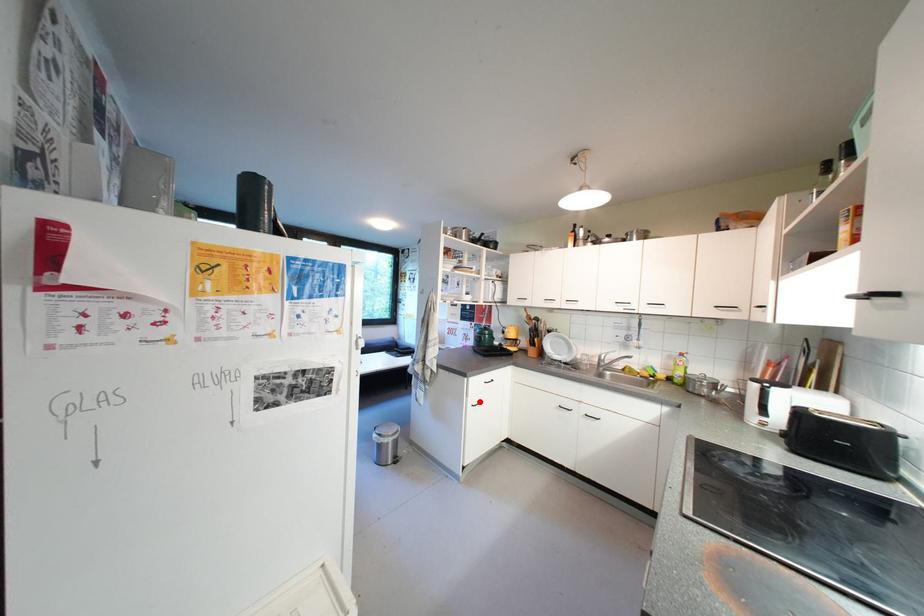
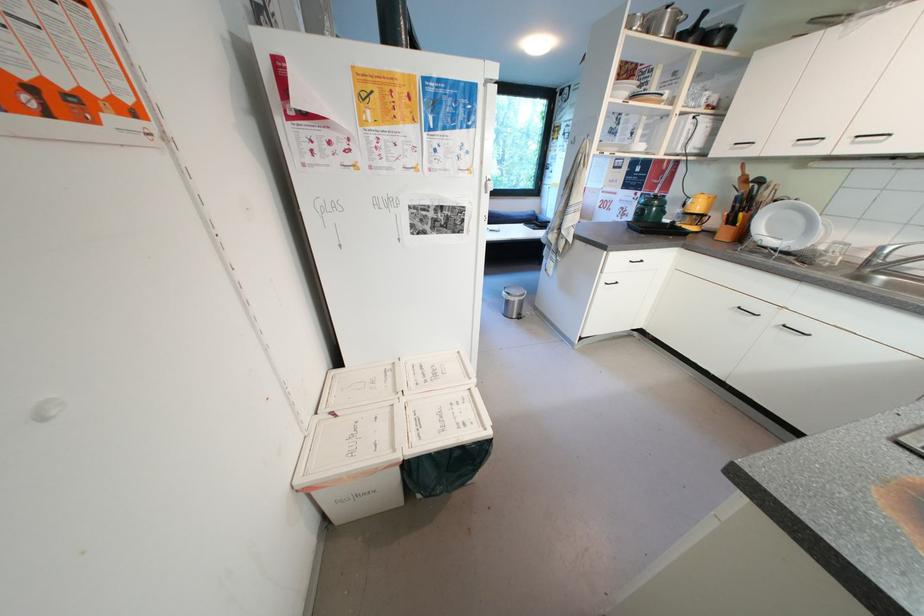
Question: A red point is marked in image1. In image2, is the corresponding 3D point closer to the camera or farther? Reply with the corresponding letter.

Choices:
 (A) The corresponding 3D point is closer.
 (B) The corresponding 3D point is farther.

Answer: (A)